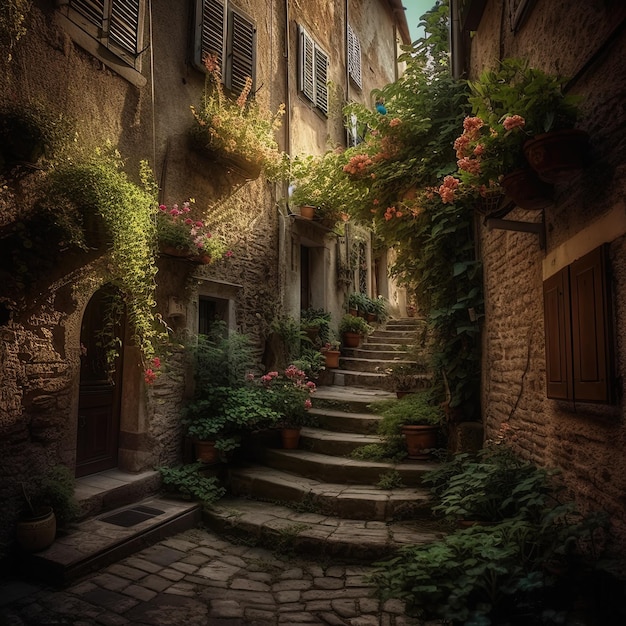
Where is `windows`? windows is located at coordinates (116, 24), (218, 41), (305, 79), (347, 59).